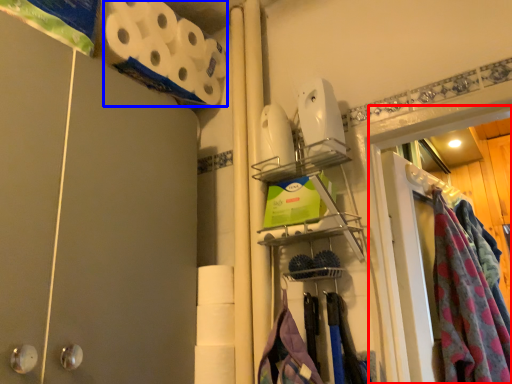
Question: Which of the following is the closest to the observer, glass door (highlighted by a red box) or toilet paper (highlighted by a blue box)?

Choices:
 (A) glass door
 (B) toilet paper

Answer: (A)